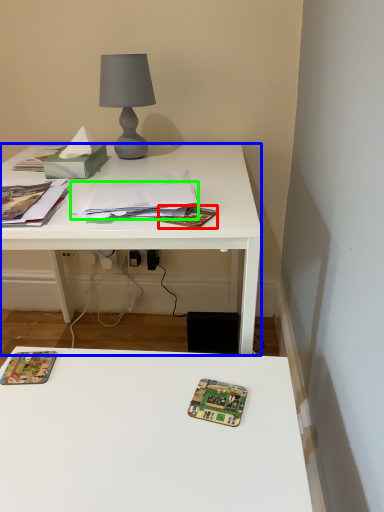
Question: Which is nearer to the paperback book (highlighted by a red box)? desk (highlighted by a blue box) or journal (highlighted by a green box).

Choices:
 (A) desk
 (B) journal

Answer: (B)